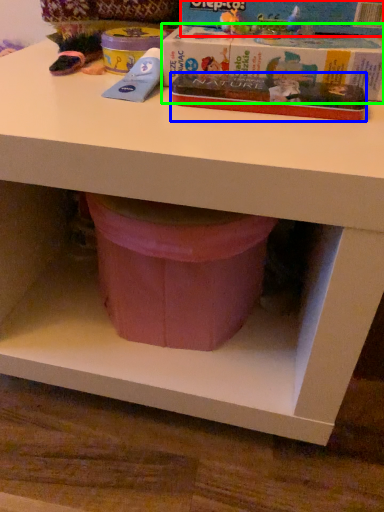
Question: Considering the real-world distances, which object is farthest from paperback book (highlighted by a red box)? paperback book (highlighted by a blue box) or paperback book (highlighted by a green box)?

Choices:
 (A) paperback book
 (B) paperback book

Answer: (A)